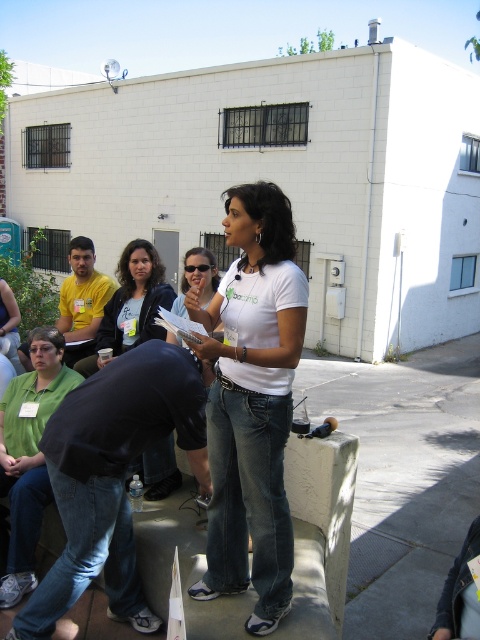
Which is below, dark blue jeans at lower left or green cotton shirt at lower left?

dark blue jeans at lower left is below.

Is dark blue jeans at lower left taller than green cotton shirt at lower left?

In fact, dark blue jeans at lower left may be shorter than green cotton shirt at lower left.

Image resolution: width=480 pixels, height=640 pixels. Describe the element at coordinates (111, 476) in the screenshot. I see `dark blue jeans at lower left` at that location.

You are a GUI agent. You are given a task and a screenshot of the screen. Output one action in this format:
    pyautogui.click(x=<x>, y=<y>)
    Task: Click on the dark blue jeans at lower left
    
    Given the screenshot: What is the action you would take?
    pyautogui.click(x=111, y=476)

How far apart are white matte shirt at center and green cotton shirt at lower left?

1.46 meters

Does white matte shirt at center appear on the right side of green cotton shirt at lower left?

Indeed, white matte shirt at center is positioned on the right side of green cotton shirt at lower left.

Which is behind, point (230, 429) or point (60, 356)?

Point (60, 356)

Identify the location of white matte shirt at center. (252, 403).

Measure the distance between point (57, 410) and camera.

8.63 feet

Can you confirm if dark blue jeans at lower left is shorter than matte black jacket at center?

No.

This screenshot has height=640, width=480. I want to click on dark blue jeans at lower left, so click(111, 476).

Find the location of `dark blue jeans at lower left`. dark blue jeans at lower left is located at coordinates (111, 476).